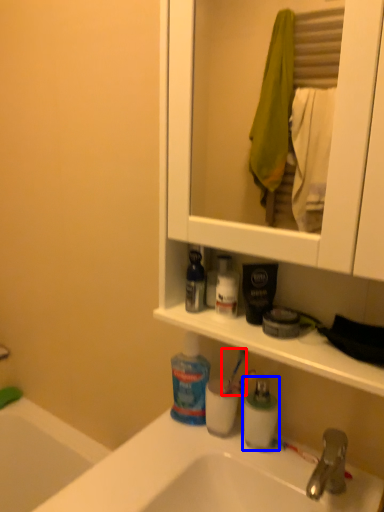
Question: Which point is closer to the camera, toothbrush (highlighted by a red box) or toiletry (highlighted by a blue box)?

Choices:
 (A) toothbrush
 (B) toiletry

Answer: (B)